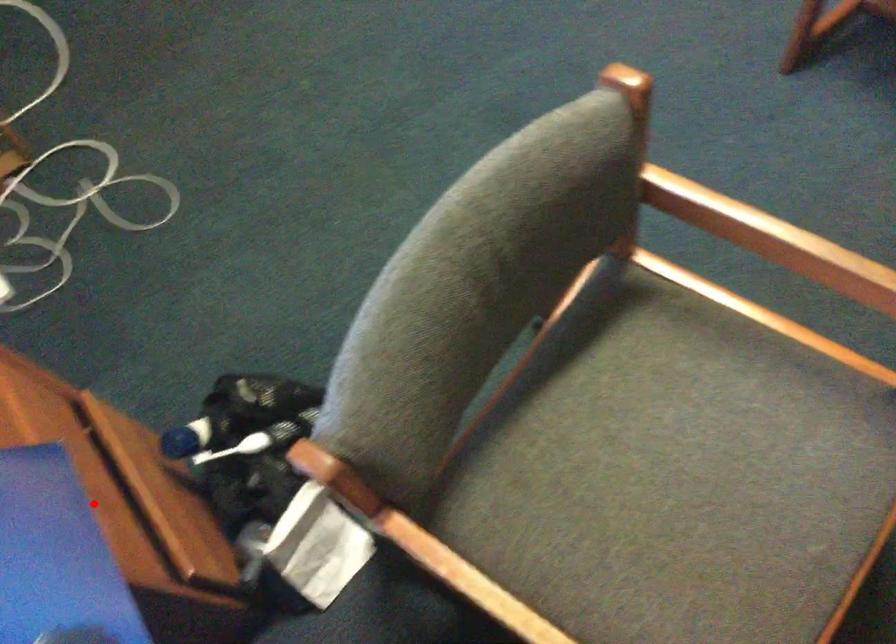
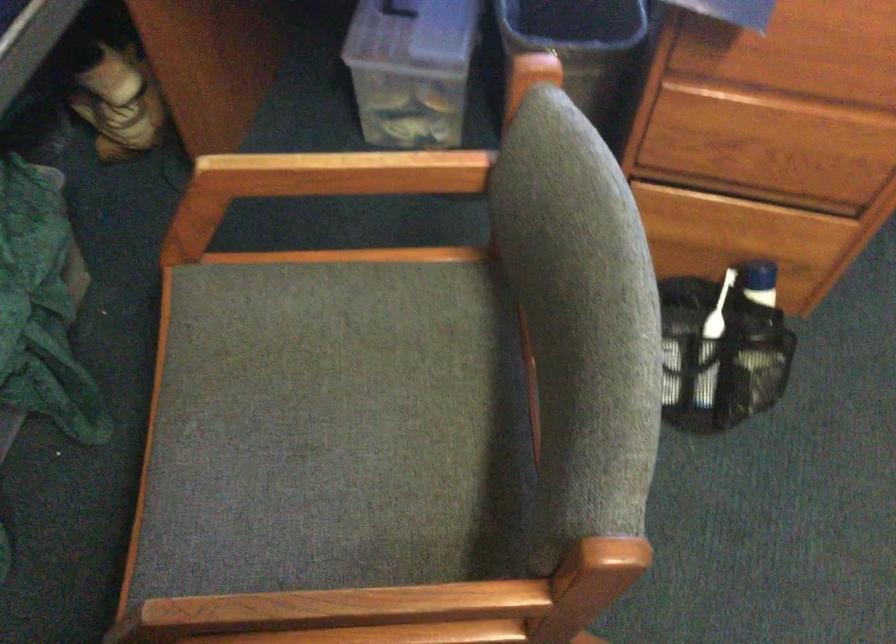
Locate, in the second image, the point that corresponds to the highlighted location in the first image.

(751, 147)